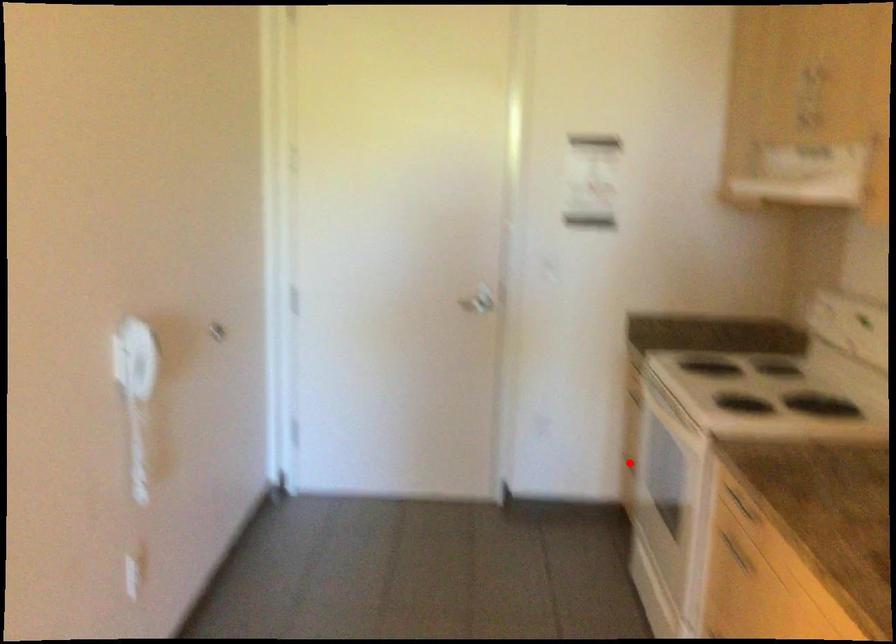
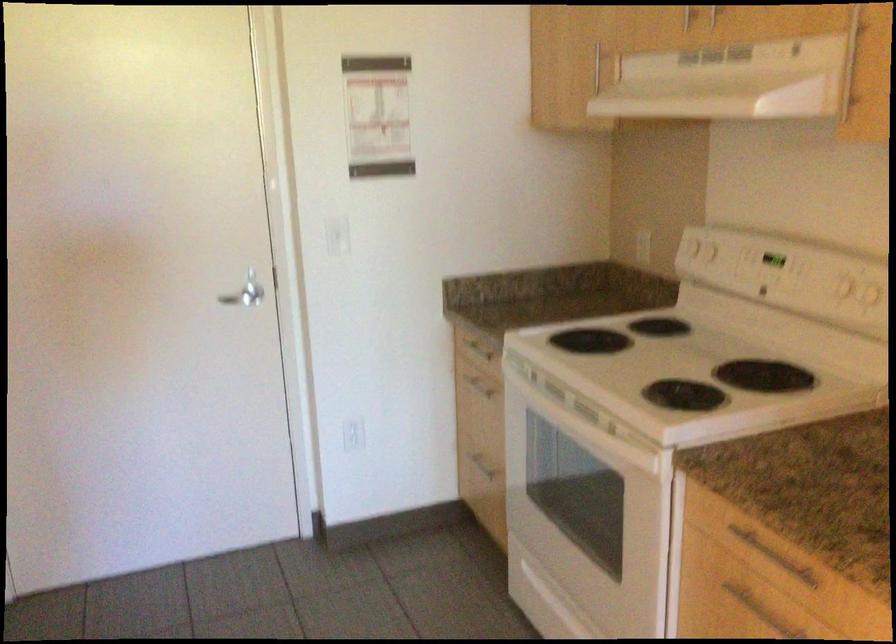
Locate, in the second image, the point that corresponds to the highlighted location in the first image.

(478, 462)